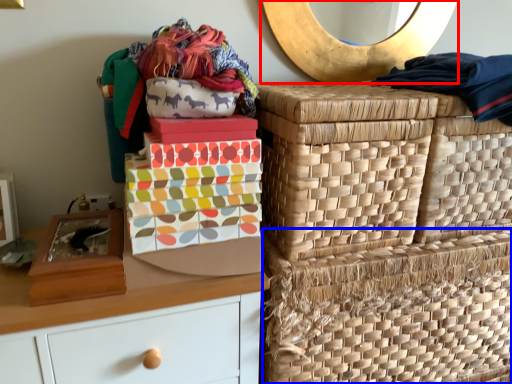
Question: Which of the following is the closest to the observer, mirror (highlighted by a red box) or basket (highlighted by a blue box)?

Choices:
 (A) mirror
 (B) basket

Answer: (B)